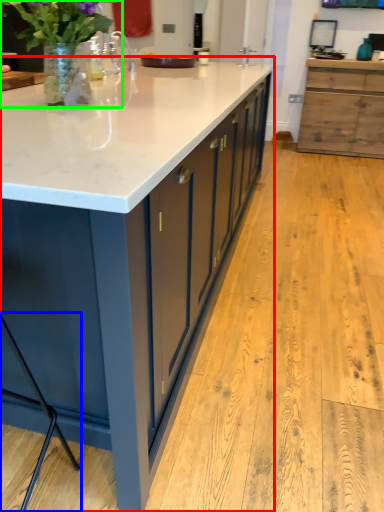
Question: Which object is the farthest from countertop (highlighted by a red box)? Choose among these: bar stool (highlighted by a blue box) or houseplant (highlighted by a green box).

Choices:
 (A) bar stool
 (B) houseplant

Answer: (A)